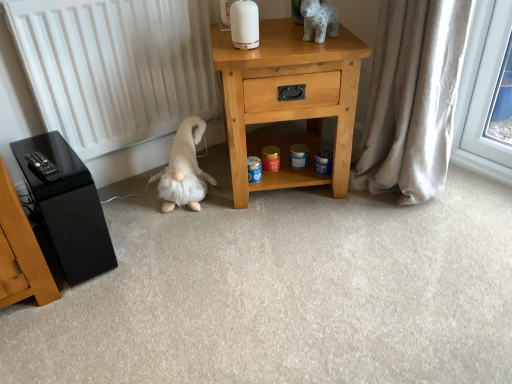
Locate an element on the screen. This screenshot has height=384, width=512. vacant space that's between fluffy white plush at lower left, positioned as the second animal in front-to-back order, and black glossy speaker at left is located at coordinates (139, 224).